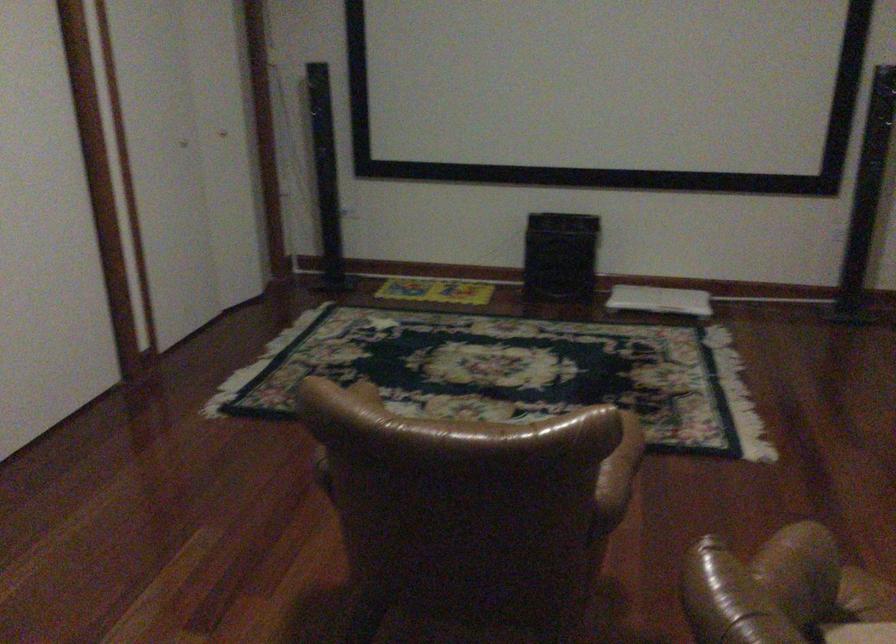
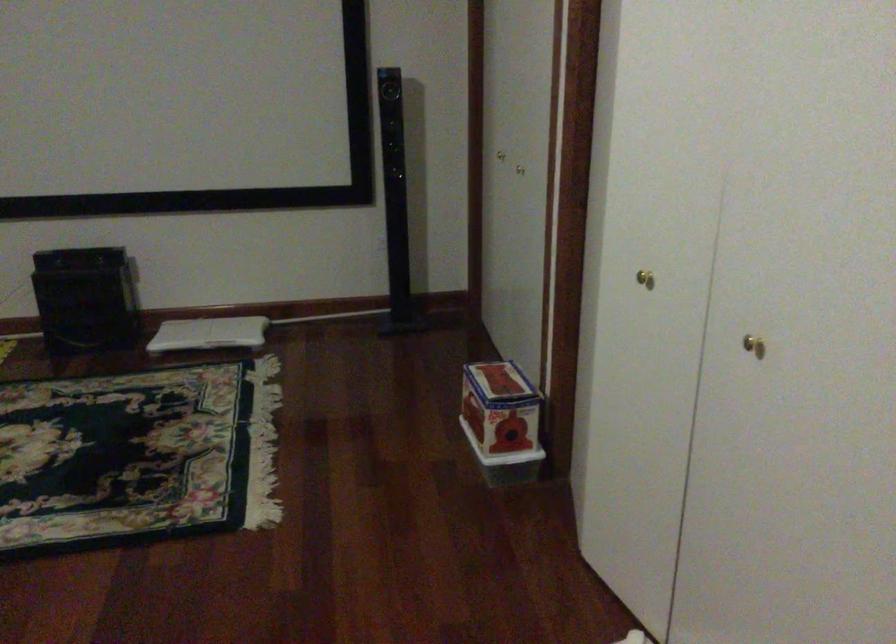
Question: The images are taken continuously from a first-person perspective. In which direction is your viewpoint rotating?

Choices:
 (A) Left
 (B) Right
 (C) Up
 (D) Down

Answer: (B)